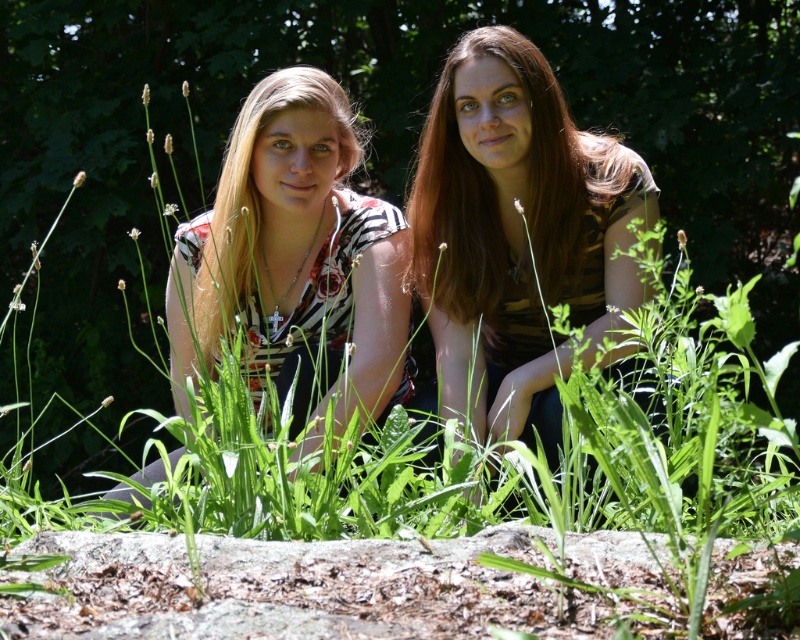
Between point (446, 72) and point (384, 323), which one is positioned in front?

Point (446, 72) is in front.

Between brown striped shirt at center and matte floral shirt at center, which one appears on the right side from the viewer's perspective?

From the viewer's perspective, brown striped shirt at center appears more on the right side.

In order to click on brown striped shirt at center in this screenshot , I will do `click(516, 236)`.

Can you confirm if matte floral shirt at center is positioned to the right of matte floral blouse at center?

Yes, matte floral shirt at center is to the right of matte floral blouse at center.

The width and height of the screenshot is (800, 640). What are the coordinates of `matte floral shirt at center` in the screenshot? It's located at (296, 260).

Image resolution: width=800 pixels, height=640 pixels. I want to click on matte floral shirt at center, so click(x=296, y=260).

Can you confirm if brown striped shirt at center is thinner than matte floral blouse at center?

Incorrect, brown striped shirt at center's width is not less than matte floral blouse at center's.

Measure the distance between point (458, 145) and camera.

Point (458, 145) and camera are 3.95 meters apart from each other.

In order to click on brown striped shirt at center in this screenshot , I will do `click(516, 236)`.